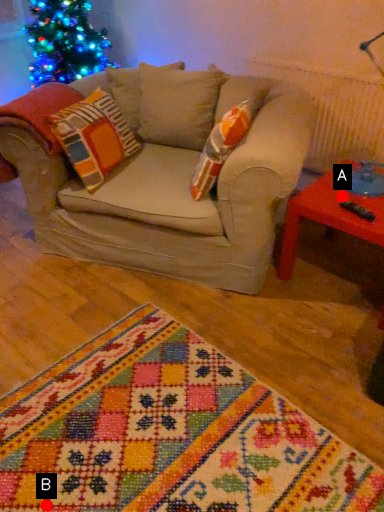
Question: Two points are circled on the image, labeled by A and B beside each circle. Which point is closer to the camera taking this photo?

Choices:
 (A) A is closer
 (B) B is closer

Answer: (B)